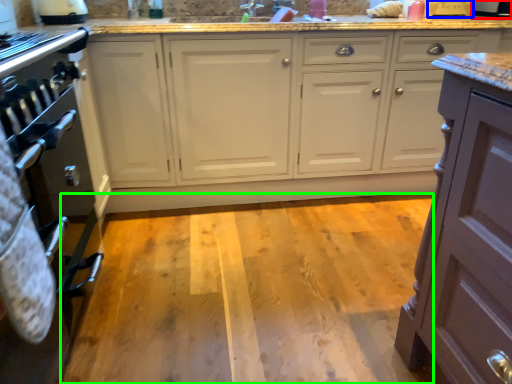
Question: Based on their relative distances, which object is farther from appliance (highlighted by a red box)? Choose from appliance (highlighted by a blue box) and plain (highlighted by a green box).

Choices:
 (A) appliance
 (B) plain

Answer: (B)